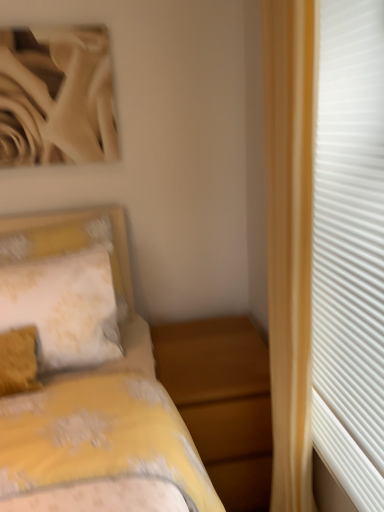
Question: Is white textured curtain at right further to camera compared to yellow floral fabric pillow at left?

Choices:
 (A) yes
 (B) no

Answer: (B)

Question: Is white textured curtain at right not close to yellow floral fabric pillow at left?

Choices:
 (A) yes
 (B) no

Answer: (B)

Question: Considering the relative positions of white textured curtain at right and yellow floral fabric pillow at left in the image provided, is white textured curtain at right to the left of yellow floral fabric pillow at left from the viewer's perspective?

Choices:
 (A) no
 (B) yes

Answer: (A)

Question: Can you confirm if white textured curtain at right is positioned to the right of yellow floral fabric pillow at left?

Choices:
 (A) yes
 (B) no

Answer: (A)

Question: From the image's perspective, does white textured curtain at right appear higher than yellow floral fabric pillow at left?

Choices:
 (A) yes
 (B) no

Answer: (A)

Question: Would you say yellow floral fabric pillow at left is to the left or to the right of matte wood nightstand at lower center in the picture?

Choices:
 (A) left
 (B) right

Answer: (A)

Question: From a real-world perspective, relative to matte wood nightstand at lower center, is yellow floral fabric pillow at left vertically above or below?

Choices:
 (A) below
 (B) above

Answer: (B)

Question: Considering the positions of point (107, 348) and point (266, 372), is point (107, 348) closer or farther from the camera than point (266, 372)?

Choices:
 (A) closer
 (B) farther

Answer: (A)

Question: From the image's perspective, is yellow floral fabric pillow at left located above or below matte wood nightstand at lower center?

Choices:
 (A) above
 (B) below

Answer: (A)

Question: Would you say white textured curtain at right is to the left or to the right of matte wood nightstand at lower center in the picture?

Choices:
 (A) left
 (B) right

Answer: (B)

Question: Is white textured curtain at right bigger or smaller than matte wood nightstand at lower center?

Choices:
 (A) small
 (B) big

Answer: (A)

Question: In the image, is white textured curtain at right positioned in front of or behind matte wood nightstand at lower center?

Choices:
 (A) behind
 (B) front

Answer: (B)

Question: From a real-world perspective, is white textured curtain at right above or below matte wood nightstand at lower center?

Choices:
 (A) above
 (B) below

Answer: (A)

Question: Would you say white textured curtain at right is to the left or to the right of yellow floral fabric pillow at left in the picture?

Choices:
 (A) right
 (B) left

Answer: (A)

Question: Looking at the image, does white textured curtain at right seem bigger or smaller compared to yellow floral fabric pillow at left?

Choices:
 (A) small
 (B) big

Answer: (B)